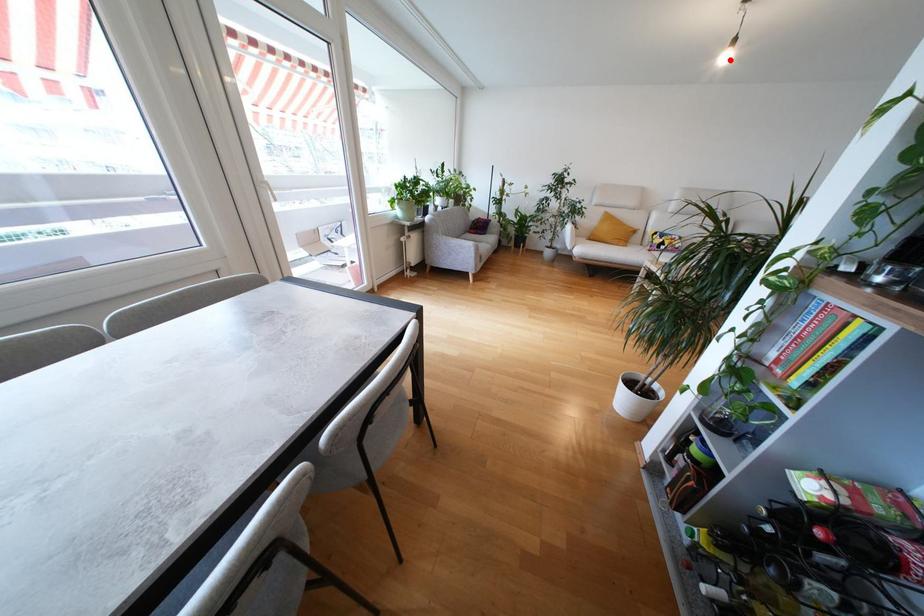
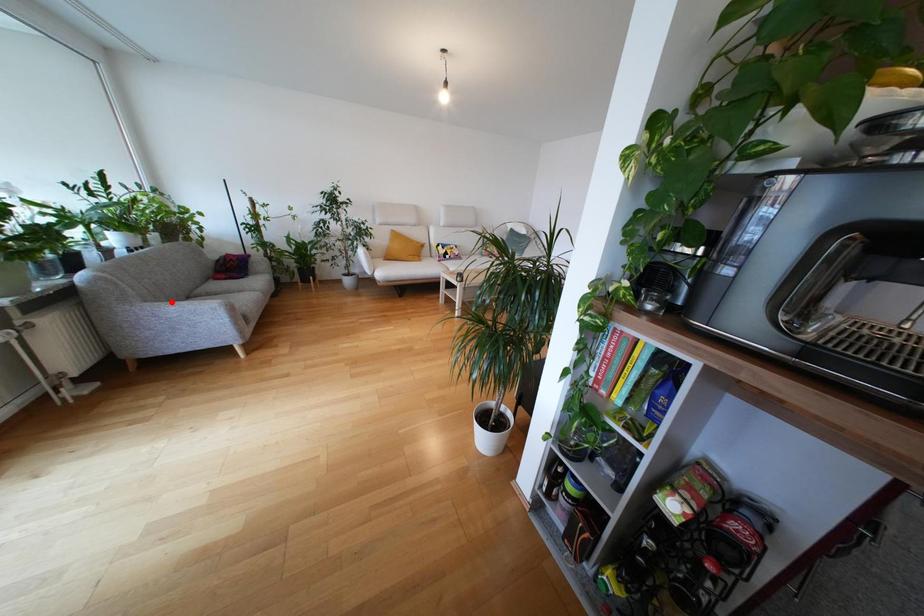
I am providing you with two images of the same scene from different viewpoints. A red point is marked on the first image and another point is marked on the second image. Is the marked point in image1 the same physical position as the marked point in image2?

No